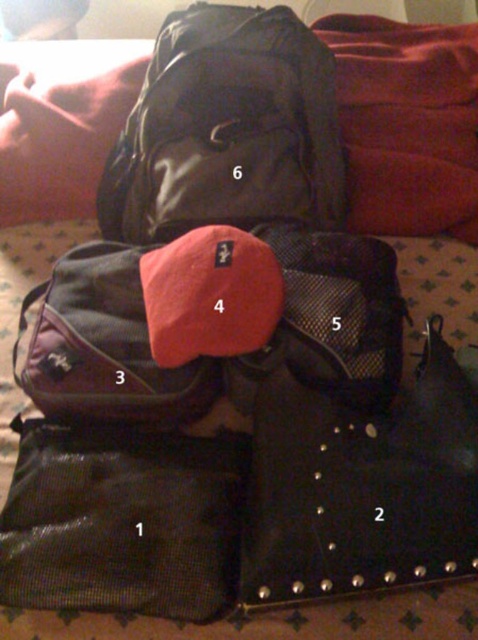
Question: Is black studded bag at center below black mesh bag at lower left?

Choices:
 (A) no
 (B) yes

Answer: (A)

Question: Which of the following is the farthest from the observer?

Choices:
 (A) (x=29, y=195)
 (B) (x=384, y=500)
 (C) (x=109, y=438)
 (D) (x=232, y=138)

Answer: (A)

Question: Can you confirm if black studded bag at center is thinner than matte black backpack at upper center?

Choices:
 (A) no
 (B) yes

Answer: (B)

Question: Does black studded bag at center appear under matte black backpack at upper center?

Choices:
 (A) no
 (B) yes

Answer: (B)

Question: Based on their relative distances, which object is farther from the black mesh bag at lower left?

Choices:
 (A) black studded bag at center
 (B) matte black backpack at upper center

Answer: (B)

Question: Which object is the farthest from the red soft pillow at upper left?

Choices:
 (A) black mesh bag at lower left
 (B) matte black backpack at upper center

Answer: (A)